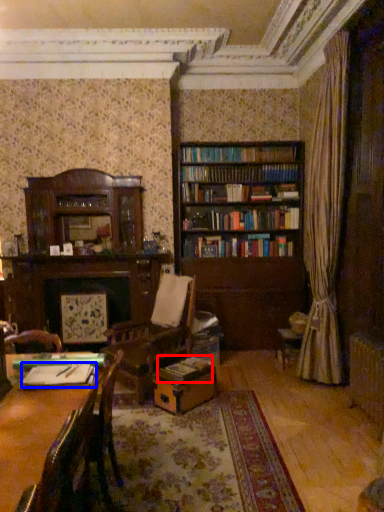
Question: Which object appears closest to the camera in this image, book (highlighted by a red box) or book (highlighted by a blue box)?

Choices:
 (A) book
 (B) book

Answer: (B)